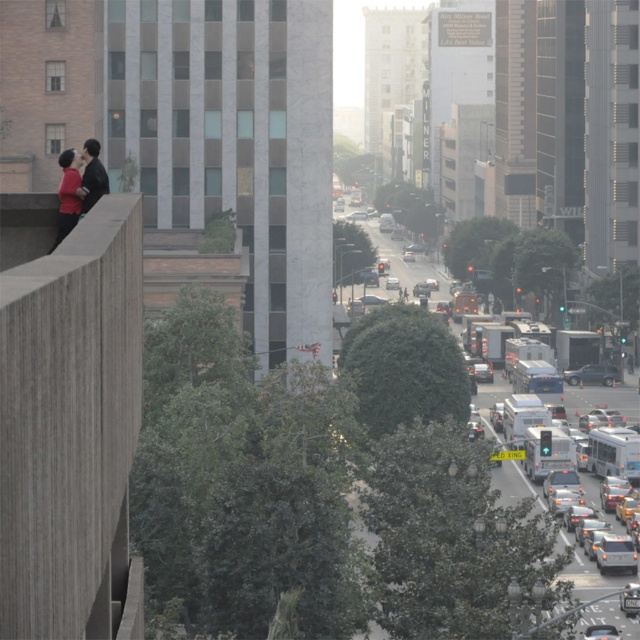
Is metallic silver bus at center smaller than silver metallic sedan at center-right?

No, metallic silver bus at center is not smaller than silver metallic sedan at center-right.

Who is more distant from viewer, (x=410, y=396) or (x=609, y=365)?

The point (x=609, y=365) is behind.

Between point (544, 556) and point (568, 381), which one is positioned in front?

Positioned in front is point (544, 556).

I want to click on metallic silver bus at center, so click(433, 492).

Can you confirm if metallic silver bus at center is smaller than matte black couple at left?

No.

Does metallic silver bus at center appear under matte black couple at left?

Indeed, metallic silver bus at center is positioned under matte black couple at left.

Describe the element at coordinates (433, 492) in the screenshot. I see `metallic silver bus at center` at that location.

Where is `metallic silver bus at center`? metallic silver bus at center is located at coordinates (433, 492).

Can you confirm if metallic silver bus at center is thinner than shiny silver sedan at lower right?

Incorrect, metallic silver bus at center's width is not less than shiny silver sedan at lower right's.

Can you confirm if metallic silver bus at center is positioned to the right of shiny silver sedan at lower right?

In fact, metallic silver bus at center is to the left of shiny silver sedan at lower right.

Where is `metallic silver bus at center`? metallic silver bus at center is located at coordinates (433, 492).